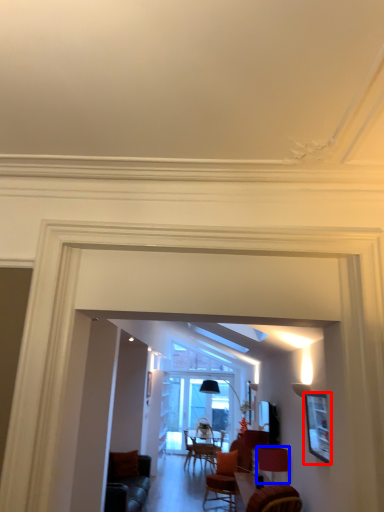
Question: Among these objects, which one is farthest to the camera, picture frame (highlighted by a red box) or lamp (highlighted by a blue box)?

Choices:
 (A) picture frame
 (B) lamp

Answer: (B)